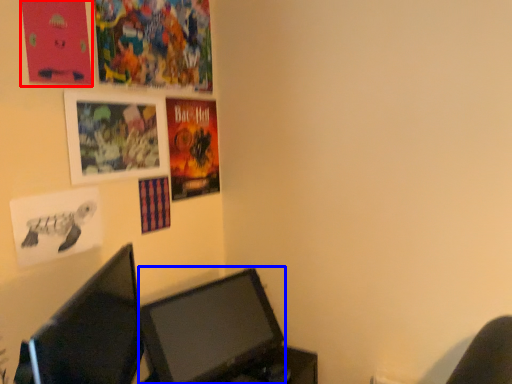
Question: Among these objects, which one is farthest to the camera, poster page (highlighted by a red box) or computer monitor (highlighted by a blue box)?

Choices:
 (A) poster page
 (B) computer monitor

Answer: (B)